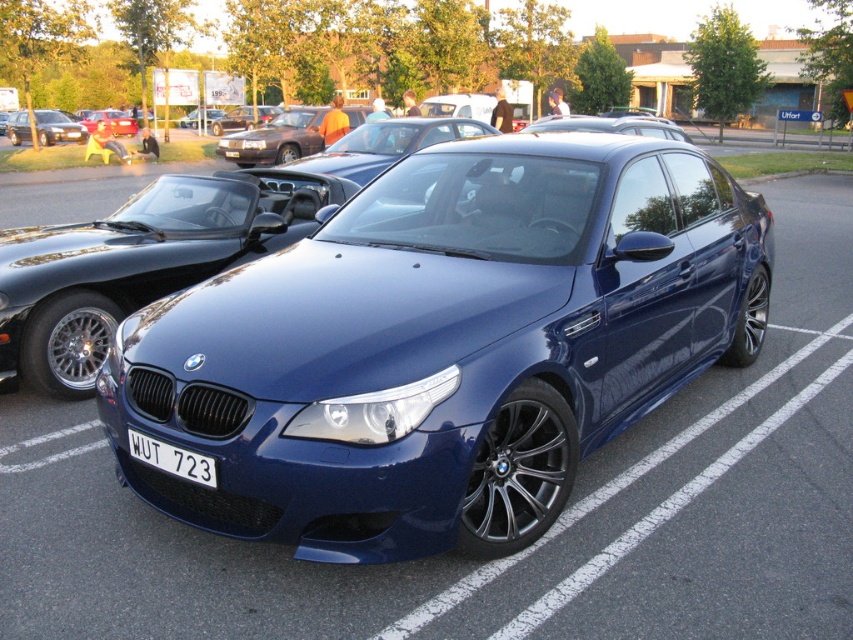
You are standing in a parking lot and see the satin blue car at center and the matte black car at center. Which car is positioned more to the right side?

The satin blue car at center is positioned more to the right side than the matte black car at center.

Looking at this image, you are a parking attendant trying to fit a new car into the parking spot where the satin blue car at center and the white plastic license plate at center are located. Based on their sizes, can the new car be parked in the same spot without overlapping?

The satin blue car at center occupies less space than the white plastic license plate at center, which indicates that the license plate is larger. However, since the license plate is part of the car, it doesn not affect the overall space required. Therefore, the new car can be parked in the same spot as long as it fits within the dimensions of the satin blue car at center.

You are a photographer trying to capture the white plastic license plate at center and the matte black sedan at left in a single shot. Based on their sizes in the image, which object will appear smaller in the photo?

The white plastic license plate at center appears smaller in the photo because it is not as tall as the matte black sedan at left.